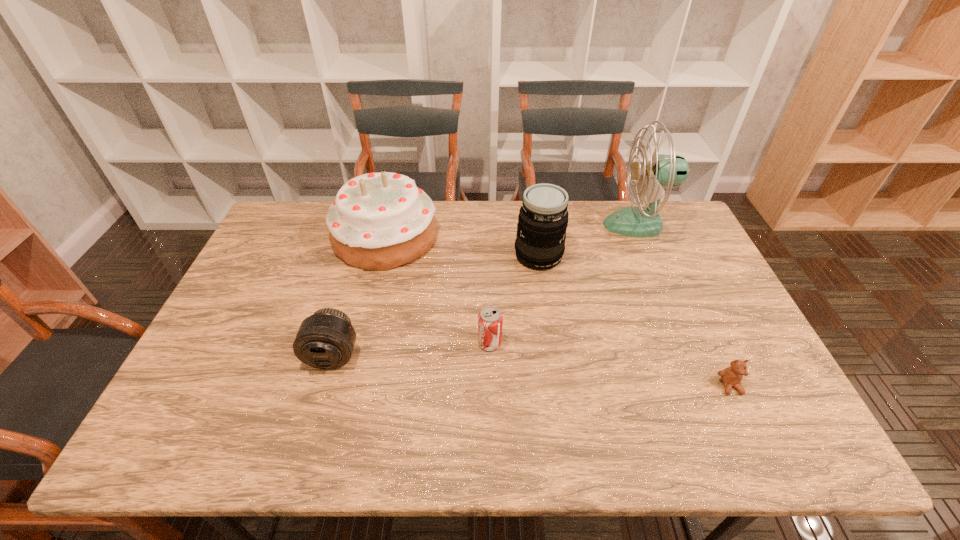
I want to click on empty location between the tallest object and the left telephoto lens, so click(485, 290).

At what (x,y) coordinates should I click in order to perform the action: click on vacant space in between the shortest object and the fan. Please return your answer as a coordinate pair (x, y). This screenshot has width=960, height=540. Looking at the image, I should click on (684, 305).

This screenshot has height=540, width=960. Find the location of `vacant area between the cake and the tallest object`. vacant area between the cake and the tallest object is located at coordinates (511, 231).

Where is `vacant region between the soda can and the left telephoto lens`? vacant region between the soda can and the left telephoto lens is located at coordinates (411, 349).

Image resolution: width=960 pixels, height=540 pixels. Identify the location of free space between the cake and the soda can. (438, 290).

Locate an element on the screen. The height and width of the screenshot is (540, 960). free point between the cake and the left telephoto lens is located at coordinates (359, 296).

You are a GUI agent. You are given a task and a screenshot of the screen. Output one action in this format:
    pyautogui.click(x=<x>, y=<y>)
    Task: Click on the free space that is in between the cake and the nearer telephoto lens
    
    Given the screenshot: What is the action you would take?
    pyautogui.click(x=359, y=296)

At what (x,y) coordinates should I click in order to perform the action: click on vacant area that lies between the shorter telephoto lens and the third object from right to left. Please return your answer as a coordinate pair (x, y). Looking at the image, I should click on (436, 306).

Identify the location of empty space that is in between the fan and the soda can. This screenshot has width=960, height=540. (564, 284).

Identify the location of the closest object relative to the third object from left to right. (543, 217).